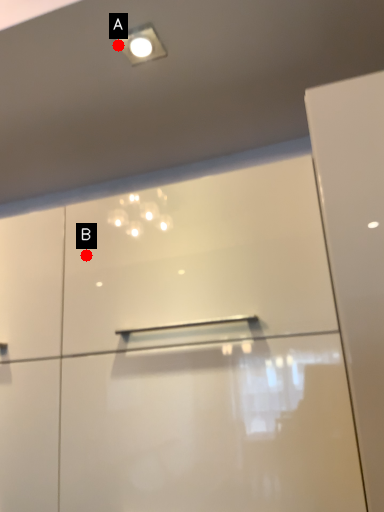
Question: Two points are circled on the image, labeled by A and B beside each circle. Which point is farther from the camera taking this photo?

Choices:
 (A) A is further
 (B) B is further

Answer: (B)